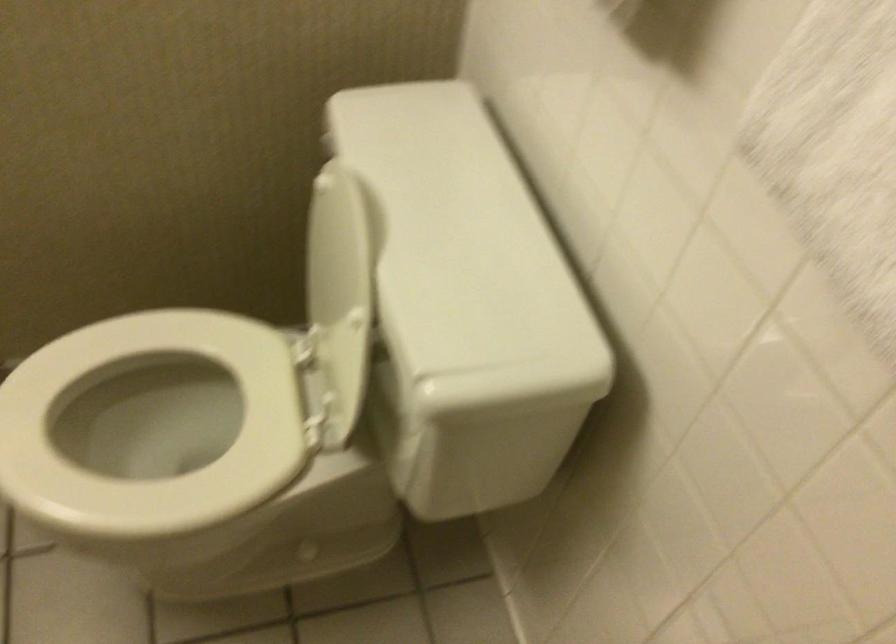
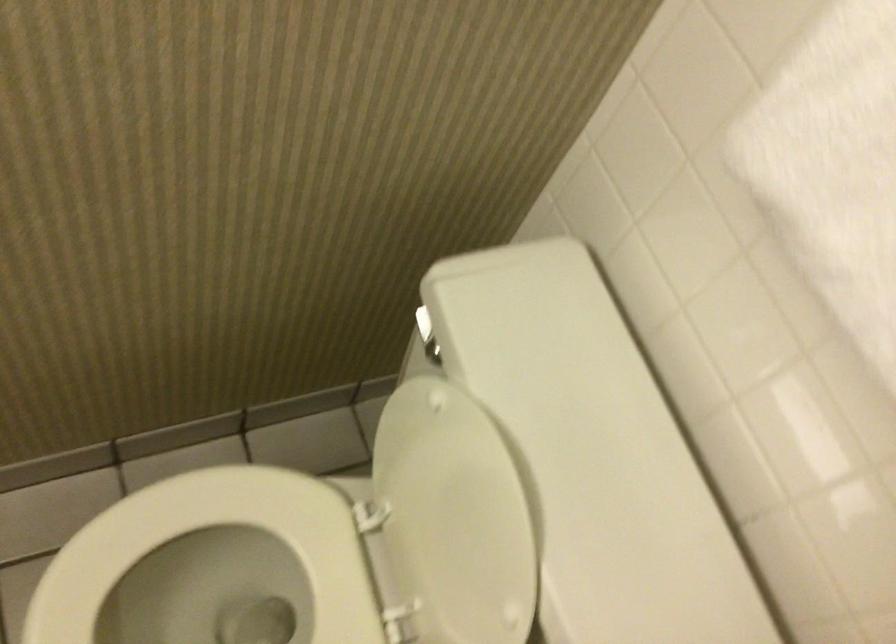
In a continuous first-person perspective shot, in which direction is the camera moving?

The cameraman moved toward left, forward.